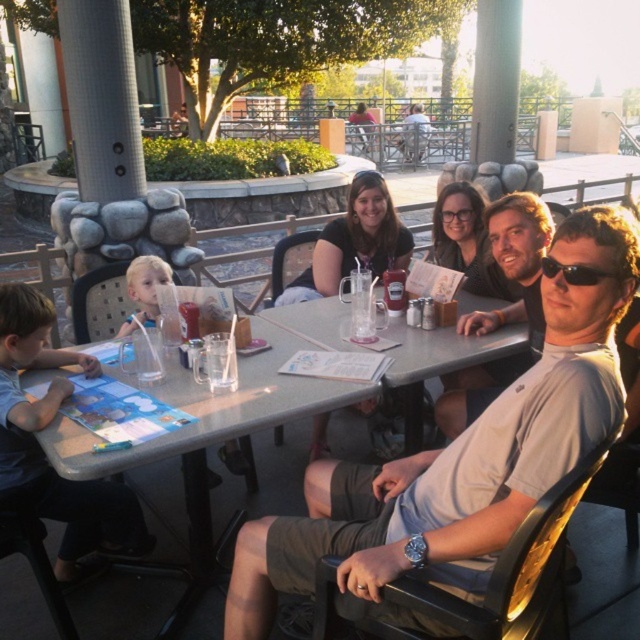
Question: Is light gray t-shirt at center below black plastic sunglasses at center?

Choices:
 (A) yes
 (B) no

Answer: (A)

Question: Does matte gray table at center have a greater width compared to light brown shirt at center?

Choices:
 (A) yes
 (B) no

Answer: (A)

Question: Which object is the closest to the light blue paper at lower left?

Choices:
 (A) light gray t-shirt at center
 (B) black plastic sunglasses at center
 (C) light brown shirt at center

Answer: (A)

Question: Which point is closer to the camera?

Choices:
 (A) (312, 308)
 (B) (611, 273)
 (C) (28, 355)

Answer: (B)

Question: Which of the following is the closest to the observer?

Choices:
 (A) matte gray table at center
 (B) black plastic sunglasses at center
 (C) light blue paper at lower left
 (D) light brown shirt at center

Answer: (B)

Question: Does light gray t-shirt at center appear over light brown shirt at center?

Choices:
 (A) no
 (B) yes

Answer: (A)